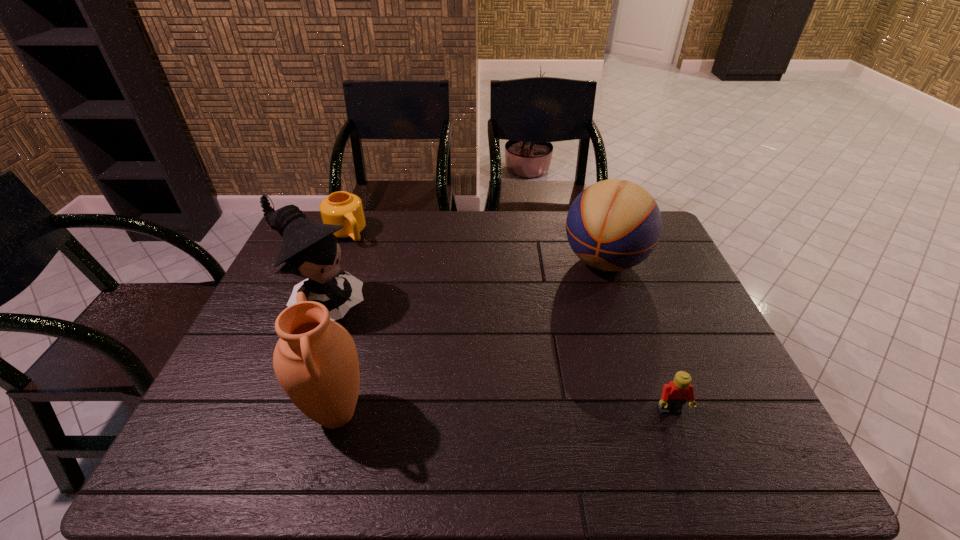
Locate an element on the screen. urn is located at coordinates (315, 360).

At what (x,y) coordinates should I click in order to perform the action: click on Lego. Please return your answer as a coordinate pair (x, y). Image resolution: width=960 pixels, height=540 pixels. Looking at the image, I should click on (674, 395).

Locate an element on the screen. The image size is (960, 540). doll is located at coordinates (310, 250).

Where is `basketball`? basketball is located at coordinates (613, 225).

Identify the location of mug. This screenshot has height=540, width=960. (342, 208).

The width and height of the screenshot is (960, 540). Find the location of `vacant space located 0.170m on the right of the urn`. vacant space located 0.170m on the right of the urn is located at coordinates (446, 414).

You are a GUI agent. You are given a task and a screenshot of the screen. Output one action in this format:
    pyautogui.click(x=<x>, y=<y>)
    Task: Click on the free region located at the face of the doll
    Image resolution: width=960 pixels, height=540 pixels.
    Given the screenshot: What is the action you would take?
    pyautogui.click(x=419, y=366)

The image size is (960, 540). Identify the location of vacant space located at the face of the doll. (466, 397).

Image resolution: width=960 pixels, height=540 pixels. Find the location of `vacant space positioned at the face of the doll`. vacant space positioned at the face of the doll is located at coordinates (446, 384).

I want to click on free spot located on the patterned surface of the basketball, so coord(565,329).